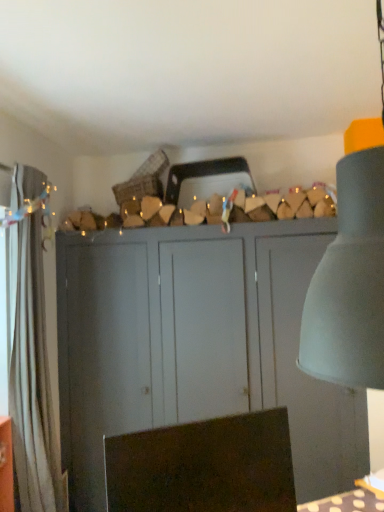
Question: Looking at their shapes, would you say brown fabric swivel chair at lower center is wider or thinner than matte gray cupboard at center?

Choices:
 (A) wide
 (B) thin

Answer: (B)

Question: Would you say brown fabric swivel chair at lower center is to the left or to the right of matte gray cupboard at center in the picture?

Choices:
 (A) right
 (B) left

Answer: (B)

Question: Considering the real-world distances, which object is farthest from the white fabric curtain at left?

Choices:
 (A) matte gray cupboard at center
 (B) brown fabric swivel chair at lower center

Answer: (B)

Question: Which is nearer to the white fabric curtain at left?

Choices:
 (A) matte gray cupboard at center
 (B) brown fabric swivel chair at lower center

Answer: (A)